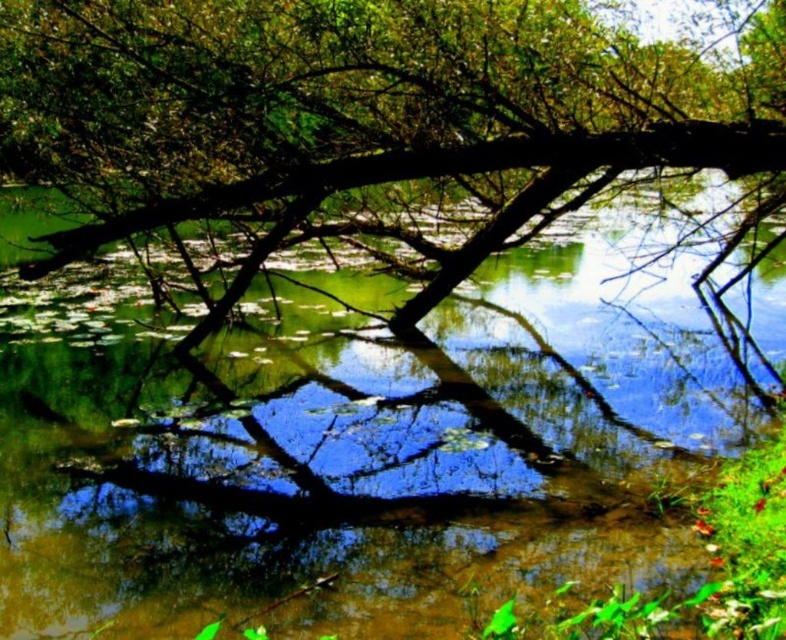
Question: Is green reflective water at center to the right of brown rough tree trunk at center from the viewer's perspective?

Choices:
 (A) no
 (B) yes

Answer: (B)

Question: Can you confirm if green reflective water at center is positioned above brown rough tree trunk at center?

Choices:
 (A) yes
 (B) no

Answer: (B)

Question: Which of the following is the closest to the observer?

Choices:
 (A) (483, 522)
 (B) (94, 134)

Answer: (A)

Question: Which point is closer to the camera taking this photo?

Choices:
 (A) (200, 3)
 (B) (138, 516)

Answer: (B)

Question: Which object is farther from the camera taking this photo?

Choices:
 (A) brown rough tree trunk at center
 (B) green reflective water at center

Answer: (A)

Question: Does green reflective water at center have a lesser width compared to brown rough tree trunk at center?

Choices:
 (A) no
 (B) yes

Answer: (B)